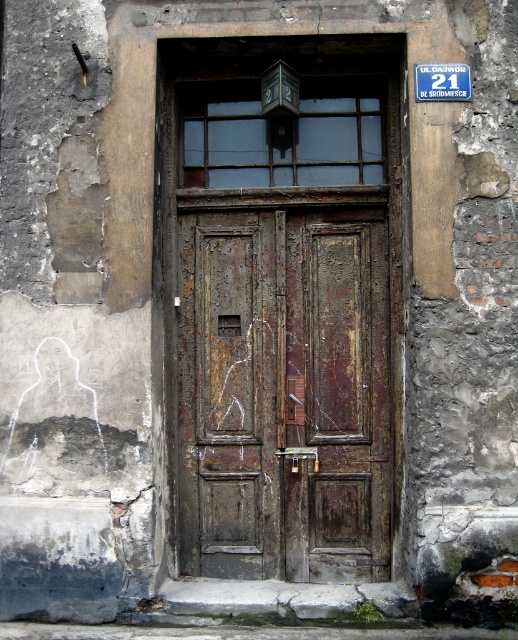
Question: Can you confirm if rusty wood door at center is bigger than blue plastic sign at upper center?

Choices:
 (A) yes
 (B) no

Answer: (A)

Question: Can you confirm if rusty wood door at center is positioned to the left of blue plastic sign at upper center?

Choices:
 (A) yes
 (B) no

Answer: (A)

Question: Can you confirm if rusty wood door at center is positioned above blue plastic sign at upper center?

Choices:
 (A) no
 (B) yes

Answer: (A)

Question: Which object is farther from the camera taking this photo?

Choices:
 (A) blue plastic sign at upper center
 (B) rusty wood door at center

Answer: (B)

Question: Which point is closer to the camera?

Choices:
 (A) (211, 410)
 (B) (414, 84)

Answer: (B)

Question: Which of the following is the closest to the observer?

Choices:
 (A) blue plastic sign at upper center
 (B) rusty wood door at center

Answer: (A)